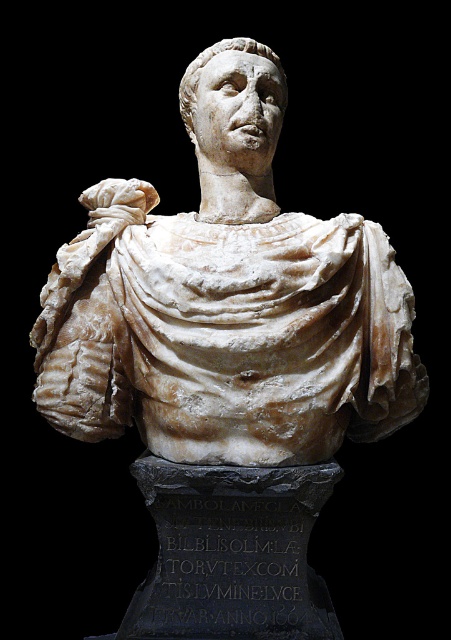
Question: Is white marble bust at center in front of white marble head at center?

Choices:
 (A) yes
 (B) no

Answer: (A)

Question: Can you confirm if white marble bust at center is thinner than white marble head at center?

Choices:
 (A) yes
 (B) no

Answer: (B)

Question: Which point appears farthest from the camera in this image?

Choices:
 (A) (183, 291)
 (B) (182, 113)

Answer: (B)

Question: Which object is farther from the camera taking this photo?

Choices:
 (A) white marble bust at center
 (B) white marble head at center

Answer: (B)

Question: Can you confirm if white marble bust at center is positioned to the right of white marble head at center?

Choices:
 (A) yes
 (B) no

Answer: (A)